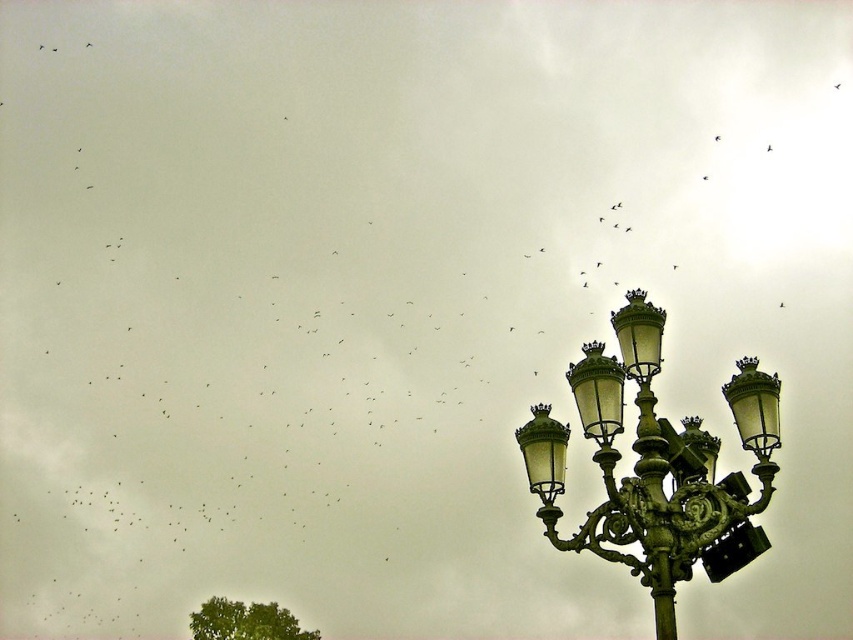
You are an architect designing a new park layout. You need to place a bench between the green patinated metal street light at right and the green leafy tree at lower left. Based on their sizes, which object should the bench be closer to?

The green patinated metal street light at right is larger in size than the green leafy tree at lower left, so the bench should be placed closer to the green leafy tree at lower left to maintain balance in the park layout.

From the picture: You are standing in the middle of the street looking at the green patinated metal street light at right and the green leafy tree at lower left. Which object is nearer to you?

The green patinated metal street light at right is closer to the viewer than the green leafy tree at lower left.